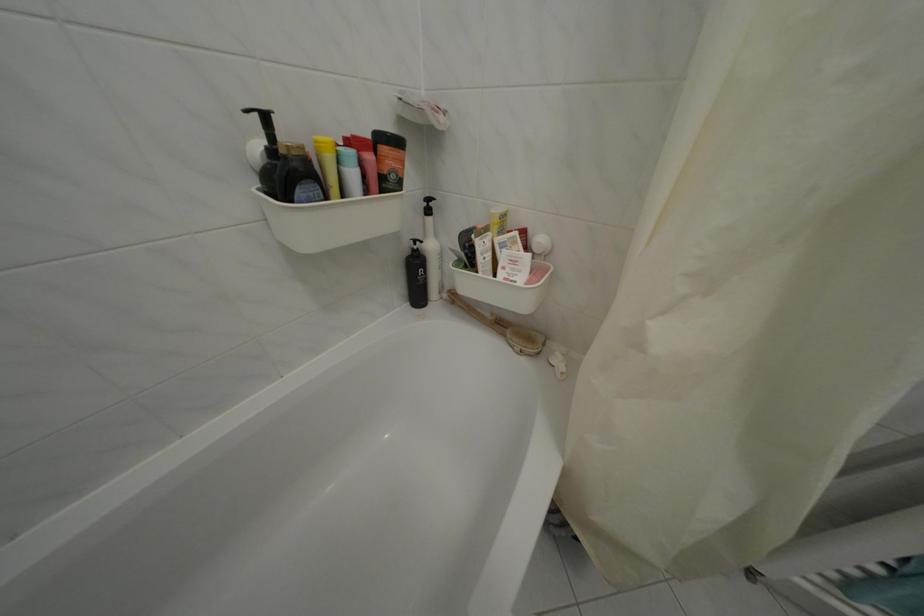
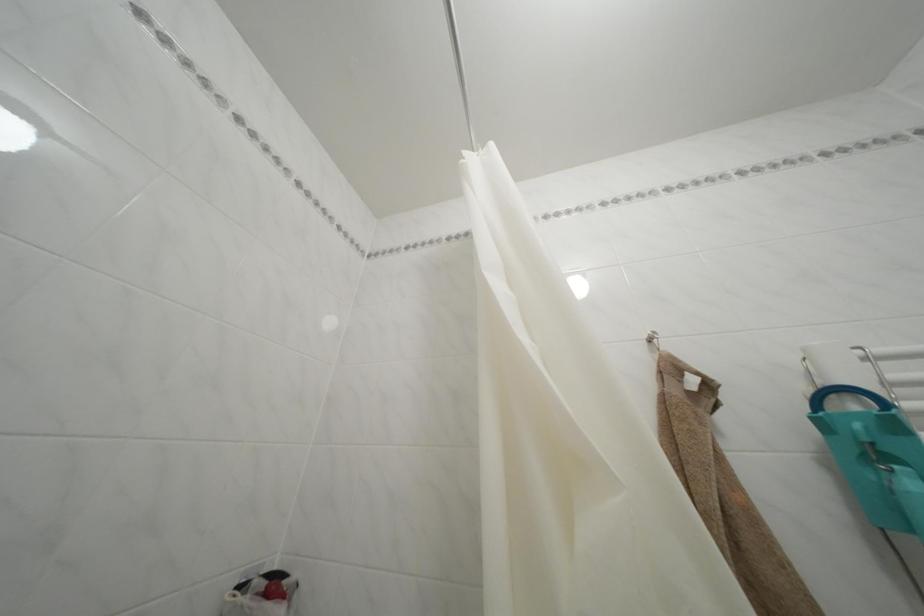
First-person continuous shooting, in which direction is the camera rotating?

The rotation direction of the camera is right-up.